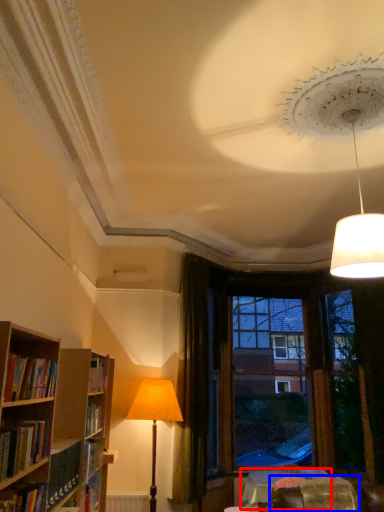
Question: Which object is further to the camera taking this photo, table (highlighted by a red box) or swivel chair (highlighted by a blue box)?

Choices:
 (A) table
 (B) swivel chair

Answer: (A)